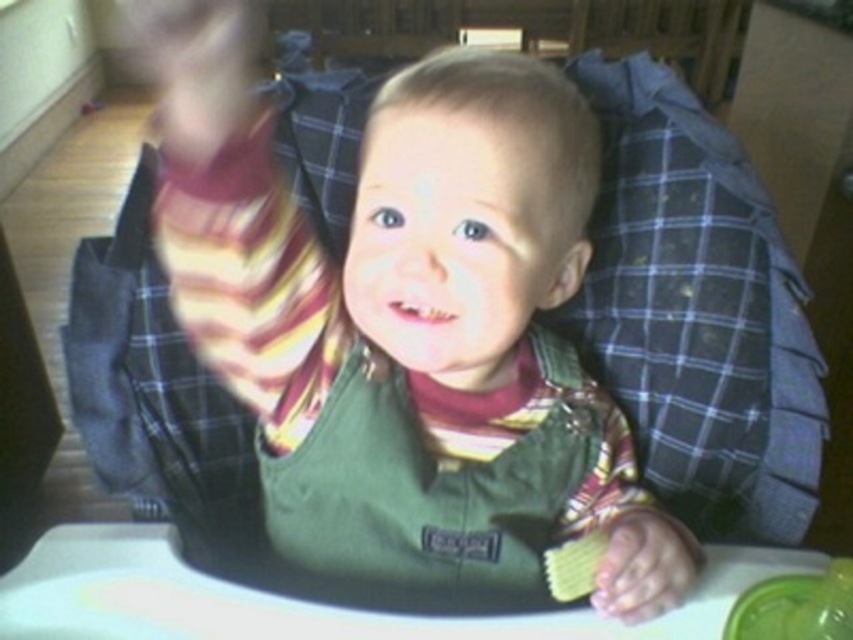
The child in the high chair has a green fabric bib at center and a smooth skin hand at center. Which object is positioned higher in the image?

The green fabric bib at center is located above the smooth skin hand at center, so the green fabric bib at center is positioned higher.

Based on the photo, you are a photographer adjusting the focus on your camera. You notice two points in the image at coordinates point [585,216] and point [628,515]. Which point should you focus on to ensure the closest object is sharp?

You should focus on point [585,216] because it is closer to the camera than point [628,515].